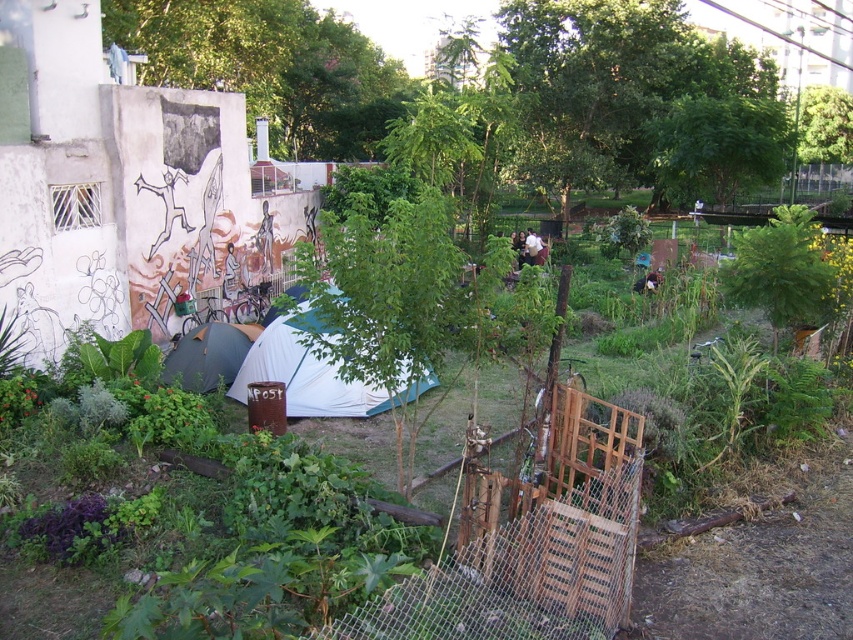
You are standing in the urban garden scene and want to place a small potted plant exactly halfway between point (300, 326) and point (527, 259). Considering their positions, will the potted plant be closer to the camera or further away from it compared to the original points?

The potted plant placed halfway between point (300, 326) and point (527, 259) will be closer to the camera than point (527, 259) but further away than point (300, 326). Since the halfway point is between the two, its distance from the camera would be an average of their distances. Since point (300, 326) is closer, the midpoint will be closer to that point and thus closer to the camera than the other point but not as close as the first one.

You are setting up a temporary shelter in the urban garden and have both the white fabric tent at center and the dark blue tarp at center available. Which material would be more suitable for blocking wind if thickness is a factor?

The dark blue tarp at center is thicker than the white fabric tent at center, making it more suitable for blocking wind.